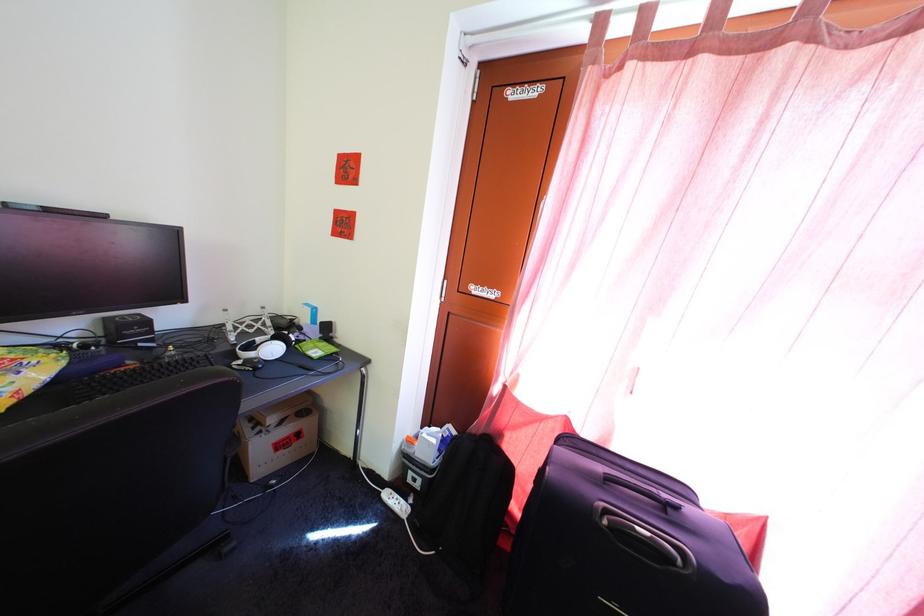
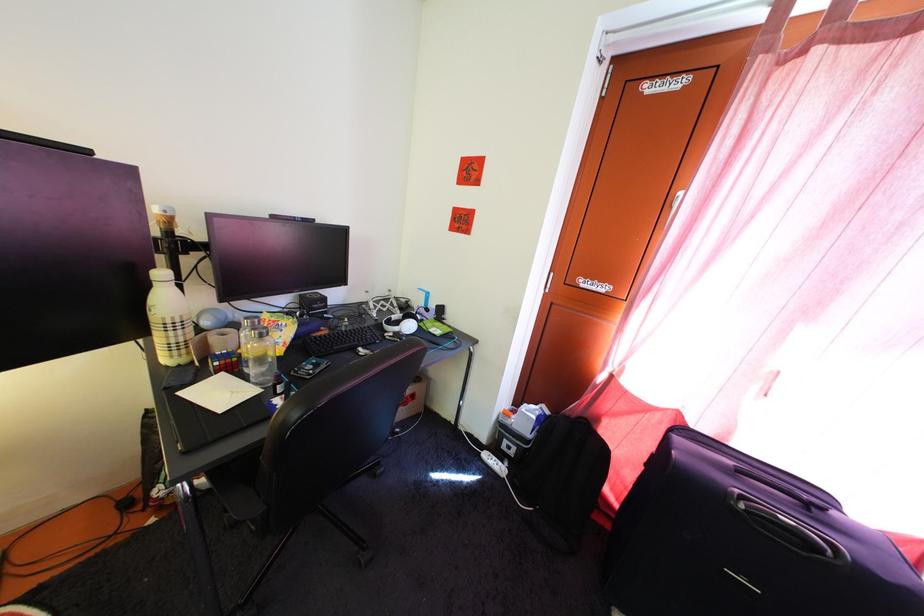
In a continuous first-person perspective shot, in which direction is the camera moving?

The movement direction of the cameraman is left, backward.